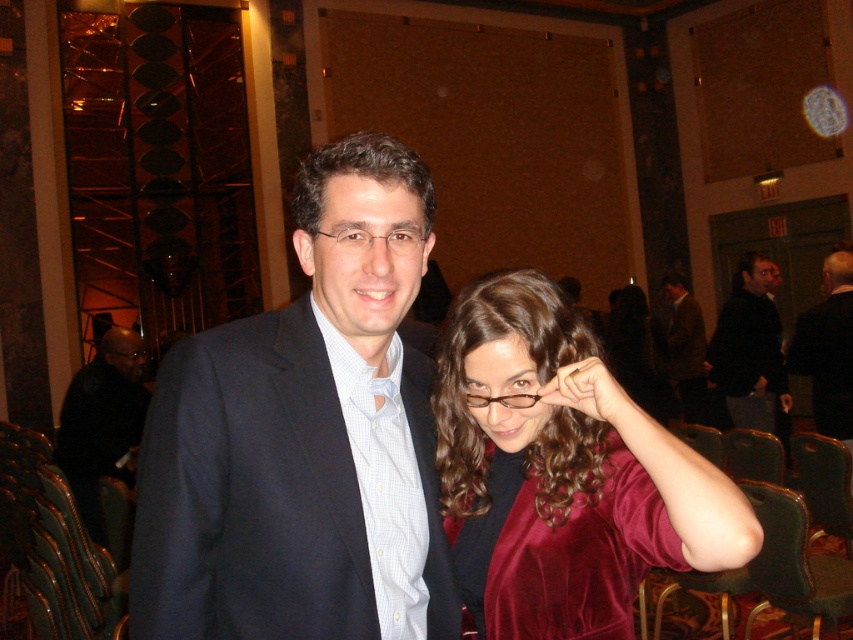
Does clear plastic glasses at center lie in front of brown translucent glasses at center?

That is True.

Which is below, clear plastic glasses at center or brown translucent glasses at center?

Positioned lower is brown translucent glasses at center.

Is point (405, 236) in front of point (511, 396)?

Yes, point (405, 236) is closer to viewer.

The width and height of the screenshot is (853, 640). What are the coordinates of `clear plastic glasses at center` in the screenshot? It's located at (376, 237).

Is point (428, 387) behind point (144, 356)?

No, (428, 387) is closer to viewer.

Describe the element at coordinates (300, 436) in the screenshot. The height and width of the screenshot is (640, 853). I see `matte black suit at center` at that location.

Locate an element on the screen. This screenshot has height=640, width=853. matte black suit at center is located at coordinates (300, 436).

In order to click on matte black suit at center in this screenshot , I will do pyautogui.click(x=300, y=436).

Does dark suit at center have a lesser height compared to dark brown suit at center?

Correct, dark suit at center is not as tall as dark brown suit at center.

Does dark suit at center have a greater width compared to dark brown suit at center?

No, dark suit at center is not wider than dark brown suit at center.

Is point (837, 337) positioned before point (682, 358)?

Yes.

Locate an element on the screen. This screenshot has height=640, width=853. dark suit at center is located at coordinates (828, 348).